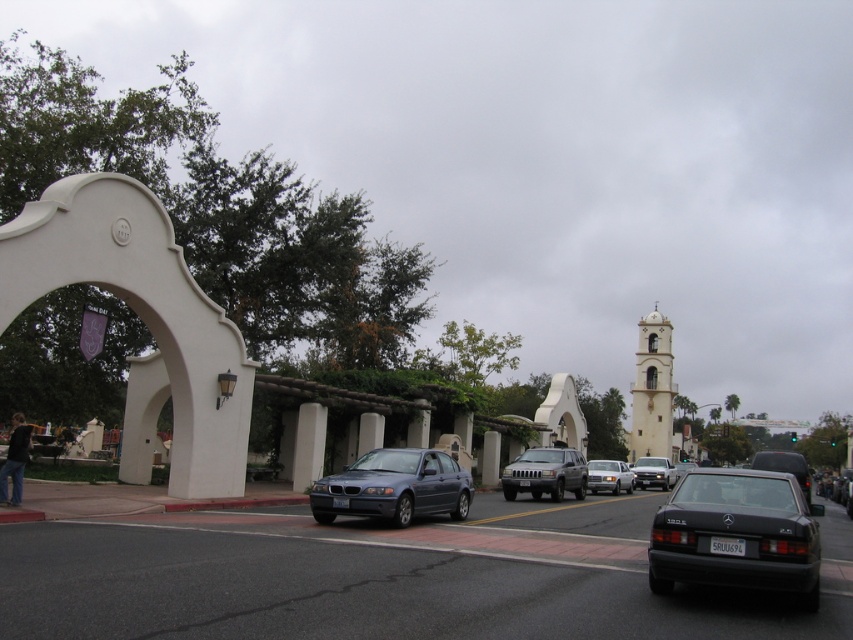
You are a delivery person who needs to park your shiny black sedan at center in a designated parking spot located at coordinates 0.730, 0.921. Can you confirm if your vehicle is already positioned correctly?

The shiny black sedan at center is already positioned at point (785, 467), so it is correctly parked in the designated parking spot.

You are a delivery person trying to park your 1.8 meters tall box in the space between the shiny black sedan at center and the matte silver sedan at center. Can the box fit vertically between them?

The shiny black sedan at center is taller than the matte silver sedan at center. The height difference means the space between them might not be consistent. However, since the box is 1.8 meters tall, and the shorter matte silver sedan at center is likely under that height, the box may not fit vertically if the lower part of the space is constrained by the sedans.